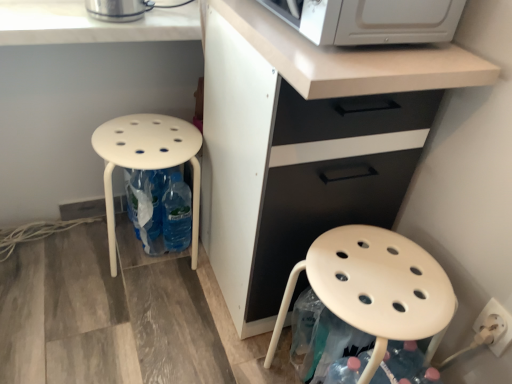
The height and width of the screenshot is (384, 512). Find the location of `free space above matte white stool at lower left, acting as the second stool starting from the left (from a real-world perspective)`. free space above matte white stool at lower left, acting as the second stool starting from the left (from a real-world perspective) is located at coordinates (370, 273).